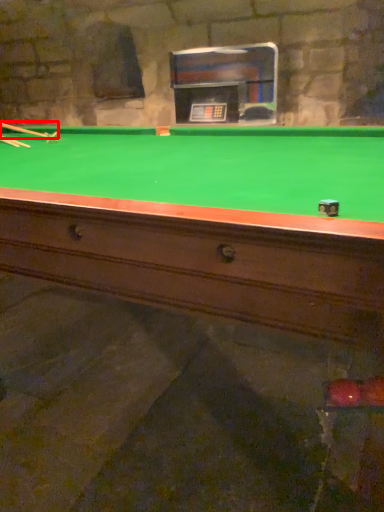
Question: From the image's perspective, where is cue (annotated by the red box) located in relation to cue in the image?

Choices:
 (A) above
 (B) below

Answer: (A)